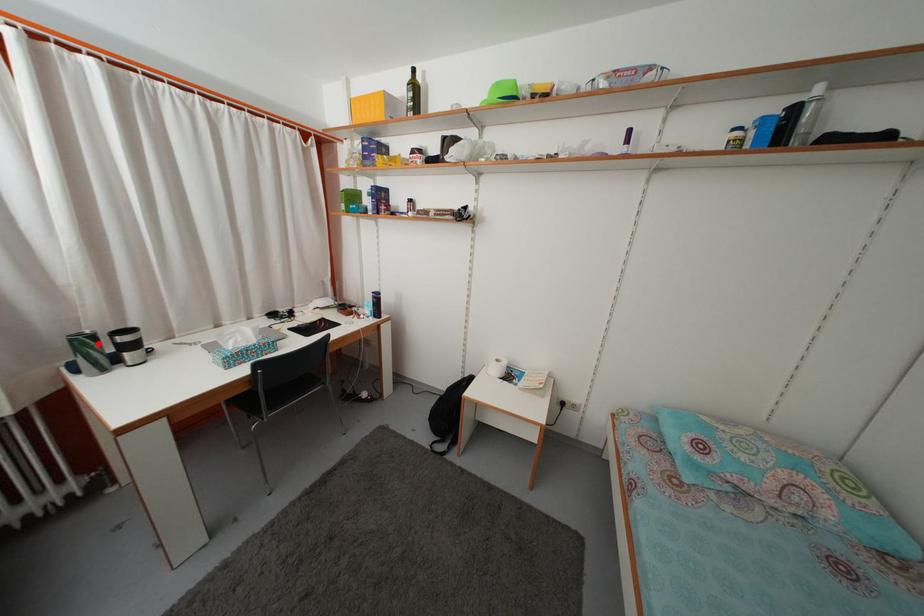
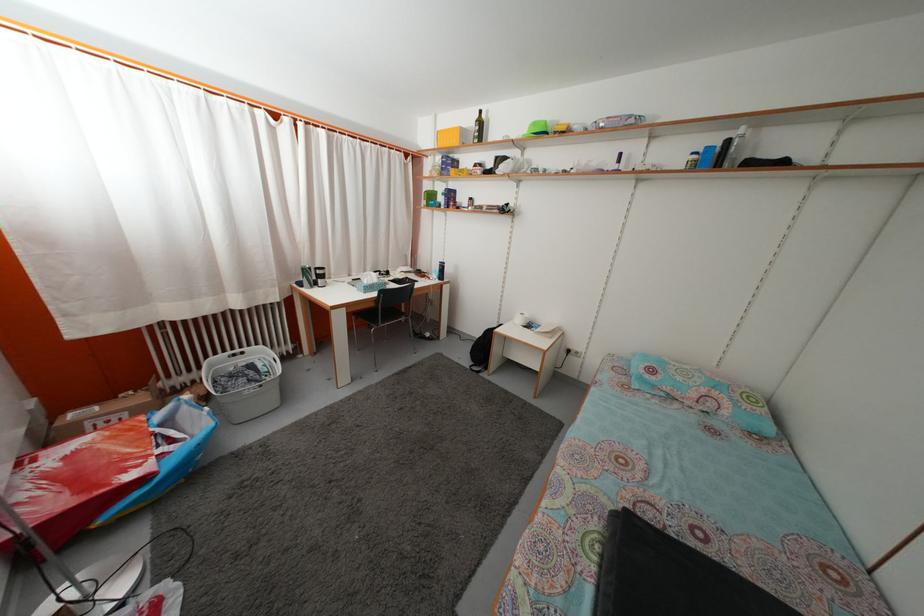
Locate, in the second image, the point that corresponds to the highlighted location in the first image.

(315, 276)